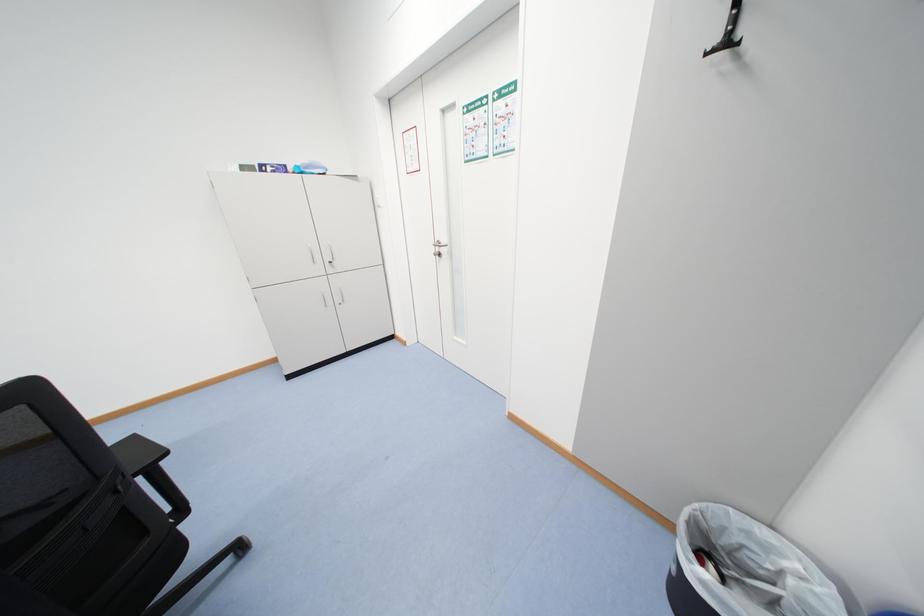
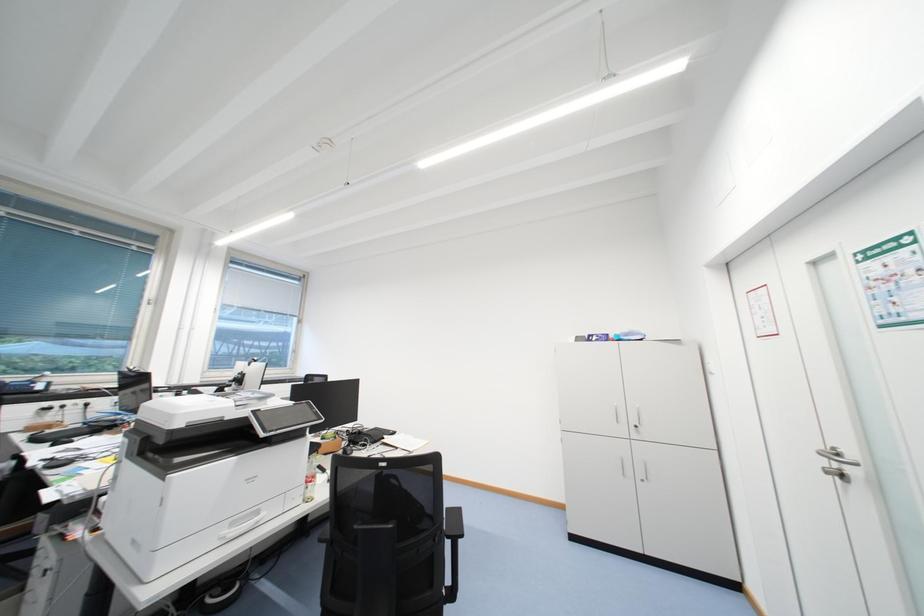
How did the camera likely rotate?

The camera's rotation is toward left-up.